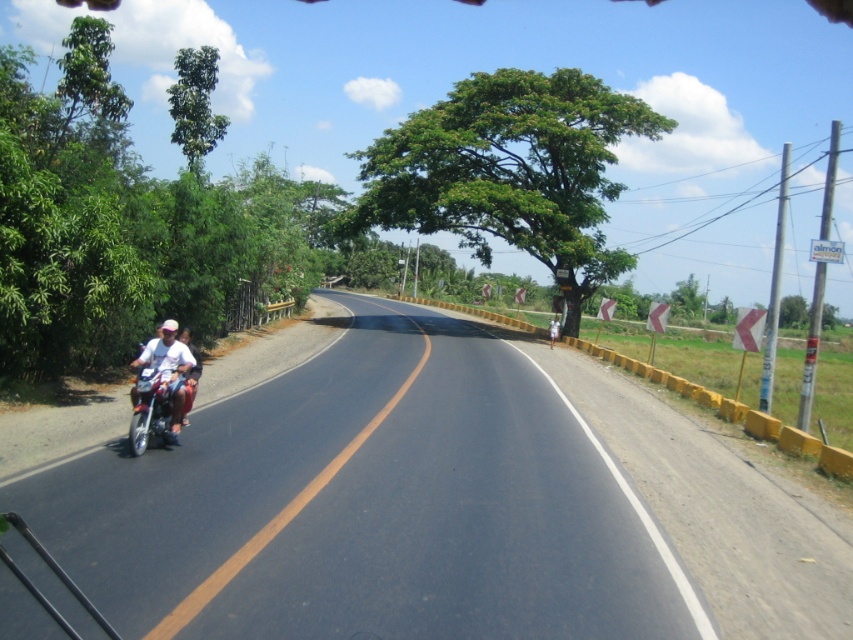
Consider the image. Who is more forward, (135, 442) or (180, 424)?

Point (135, 442) is in front.

Can you confirm if metallic silver motorcycle at left is smaller than white matte motorcycle at left?

Yes.

Locate an element on the screen. metallic silver motorcycle at left is located at coordinates (160, 388).

Which is behind, point (397, 508) or point (131, 429)?

Point (131, 429)

Who is higher up, black asphalt road at left or metallic silver motorcycle at left?

Positioned higher is metallic silver motorcycle at left.

What are the coordinates of `black asphalt road at left` in the screenshot? It's located at click(427, 499).

In order to click on black asphalt road at left in this screenshot , I will do `click(427, 499)`.

What do you see at coordinates (427, 499) in the screenshot? The image size is (853, 640). I see `black asphalt road at left` at bounding box center [427, 499].

Who is positioned more to the right, black asphalt road at left or white matte motorcycle at left?

Positioned to the right is black asphalt road at left.

Describe the element at coordinates (427, 499) in the screenshot. I see `black asphalt road at left` at that location.

What are the coordinates of `black asphalt road at left` in the screenshot? It's located at (427, 499).